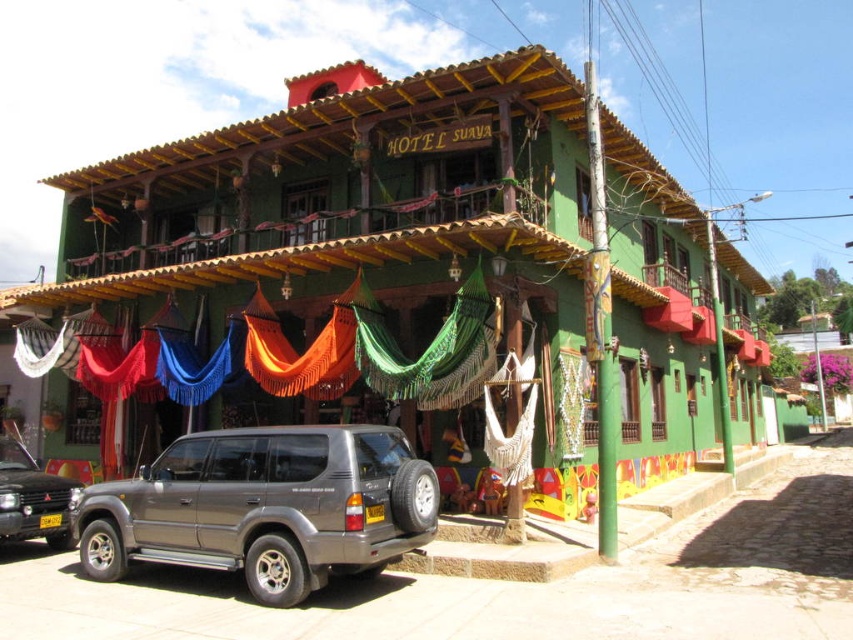
Does green woven hammocks at center have a greater width compared to metallic gray suv at center?

Correct, the width of green woven hammocks at center exceeds that of metallic gray suv at center.

Is green woven hammocks at center positioned before metallic gray suv at center?

No, green woven hammocks at center is further to the viewer.

The height and width of the screenshot is (640, 853). I want to click on green woven hammocks at center, so click(410, 278).

Is green woven hammocks at center taller than metallic gray suv at lower left?

Indeed, green woven hammocks at center has a greater height compared to metallic gray suv at lower left.

Who is positioned more to the left, green woven hammocks at center or metallic gray suv at lower left?

metallic gray suv at lower left is more to the left.

Does point (216, 145) lie in front of point (15, 536)?

That is False.

At what (x,y) coordinates should I click in order to perform the action: click on green woven hammocks at center. Please return your answer as a coordinate pair (x, y). This screenshot has height=640, width=853. Looking at the image, I should click on click(x=410, y=278).

Between metallic gray suv at center and metallic gray suv at lower left, which one is positioned lower?

metallic gray suv at lower left is lower down.

Is metallic gray suv at center smaller than metallic gray suv at lower left?

No.

Image resolution: width=853 pixels, height=640 pixels. I want to click on metallic gray suv at center, so click(x=265, y=508).

You are a GUI agent. You are given a task and a screenshot of the screen. Output one action in this format:
    pyautogui.click(x=<x>, y=<y>)
    Task: Click on the metallic gray suv at center
    The width and height of the screenshot is (853, 640).
    Given the screenshot: What is the action you would take?
    pyautogui.click(x=265, y=508)